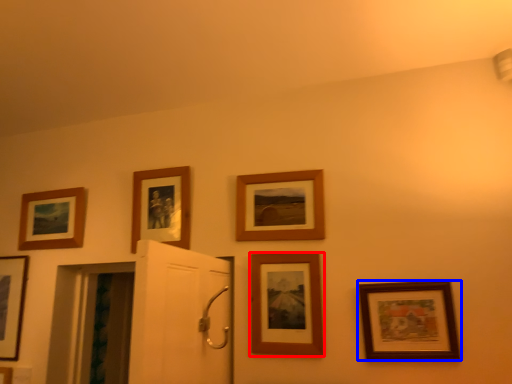
Question: Among these objects, which one is nearest to the camera, picture frame (highlighted by a red box) or picture frame (highlighted by a blue box)?

Choices:
 (A) picture frame
 (B) picture frame

Answer: (B)